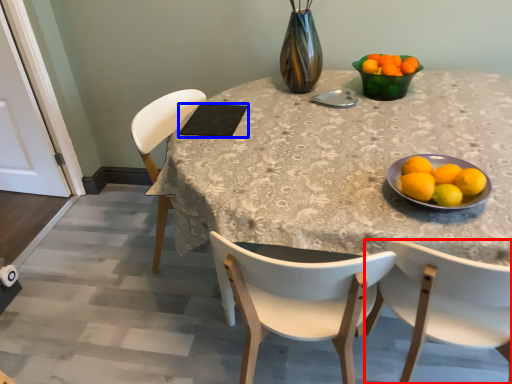
Question: Among these objects, which one is farthest to the camera, chair (highlighted by a red box) or pad (highlighted by a blue box)?

Choices:
 (A) chair
 (B) pad

Answer: (B)